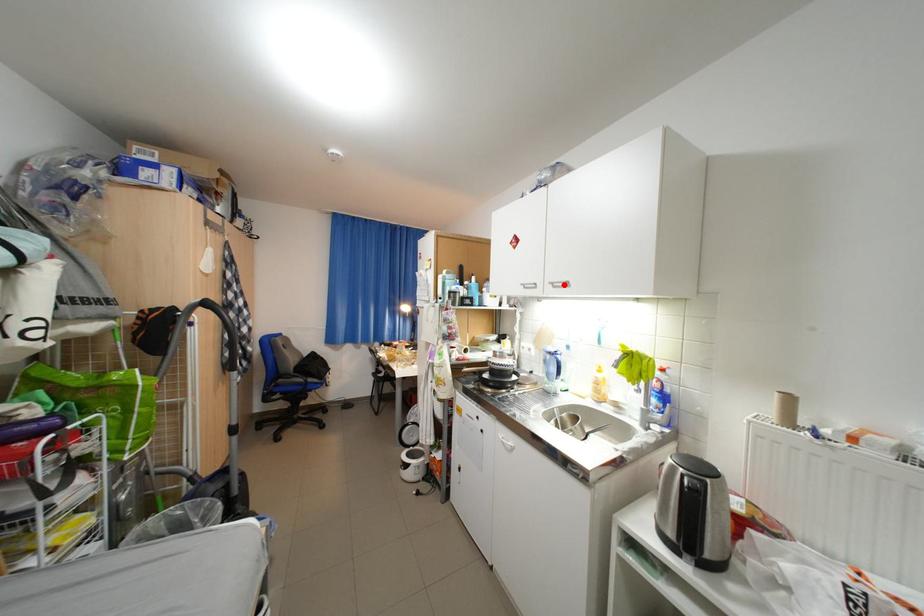
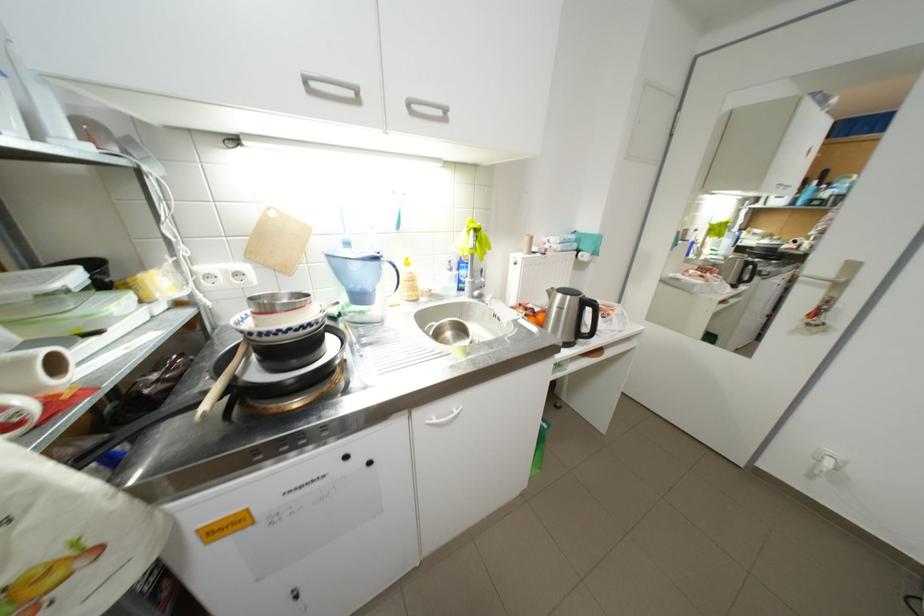
The point at the highlighted location is marked in the first image. Where is the corresponding point in the second image?

(420, 105)